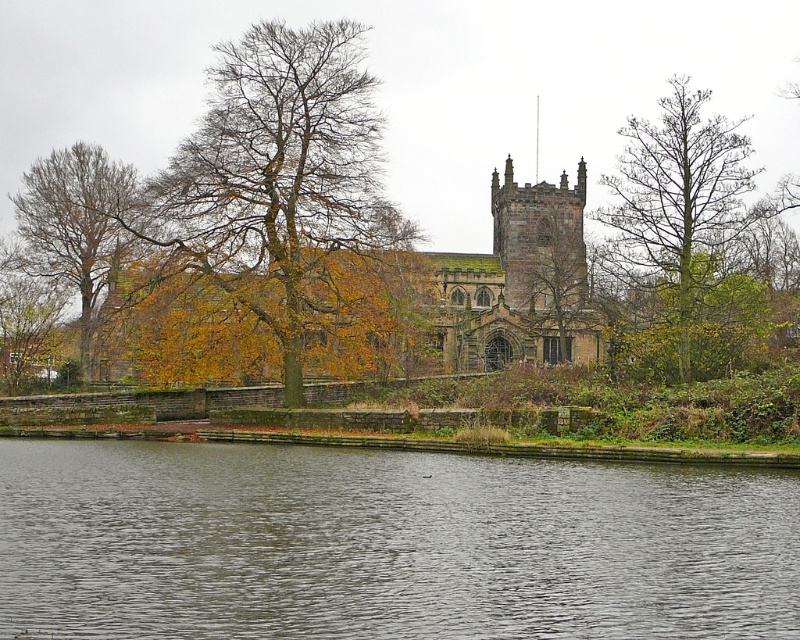
Question: Among these objects, which one is nearest to the camera?

Choices:
 (A) brown leafy tree at center
 (B) brown leafy tree at left

Answer: (A)

Question: From the image, what is the correct spatial relationship of brown leafy tree at left in relation to green leafy tree at center?

Choices:
 (A) above
 (B) below

Answer: (A)

Question: Which point is farther from the camera taking this photo?

Choices:
 (A) (289, 349)
 (B) (38, 198)

Answer: (B)

Question: Which point appears closest to the camera in this image?

Choices:
 (A) (720, 163)
 (B) (354, 52)
 (C) (80, 317)

Answer: (A)

Question: Can you confirm if brown leafy tree at left is thinner than green leafy tree at center?

Choices:
 (A) no
 (B) yes

Answer: (A)

Question: Considering the relative positions of dark gray water at lower center and green leafy tree at center in the image provided, where is dark gray water at lower center located with respect to green leafy tree at center?

Choices:
 (A) above
 (B) below

Answer: (B)